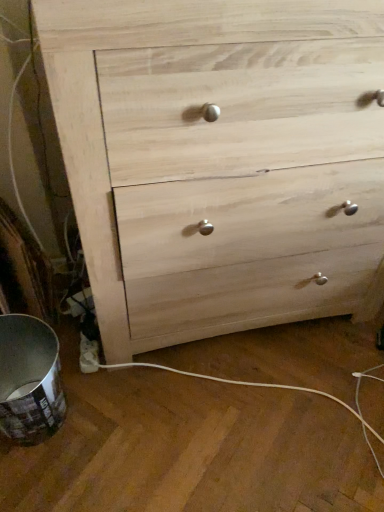
This screenshot has width=384, height=512. What do you see at coordinates (220, 160) in the screenshot?
I see `natural wood chest of drawers at center` at bounding box center [220, 160].

Locate an element on the screen. natural wood chest of drawers at center is located at coordinates (220, 160).

What is the approximate width of natural wood chest of drawers at center?

22.36 inches.

Identify the location of natural wood chest of drawers at center. (220, 160).